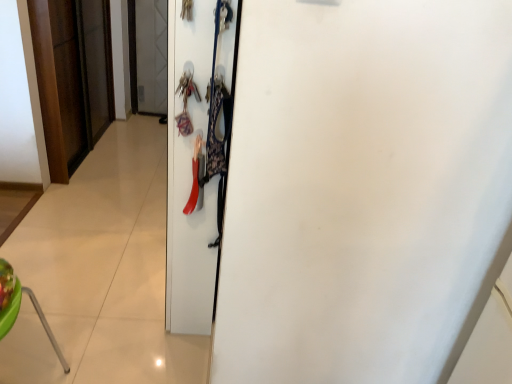
The height and width of the screenshot is (384, 512). Find the location of `unoccupied region to the right of wooden door at left, which ranks as the second door in front-to-back order`. unoccupied region to the right of wooden door at left, which ranks as the second door in front-to-back order is located at coordinates (128, 158).